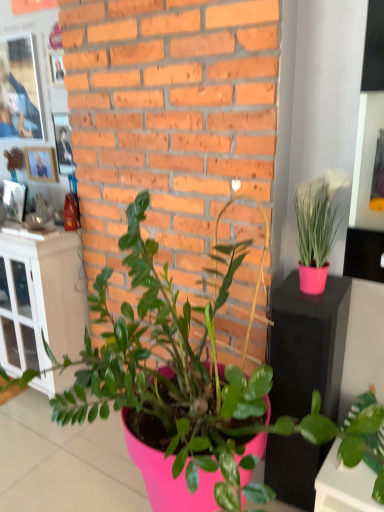
Question: From a real-world perspective, is green matte plant at lower right, positioned as the first houseplant in right-to-left order, physically located above or below wooden photo frame at upper left?

Choices:
 (A) above
 (B) below

Answer: (B)

Question: Considering the positions of green matte plant at lower right, positioned as the first houseplant in right-to-left order, and wooden photo frame at upper left in the image, is green matte plant at lower right, positioned as the first houseplant in right-to-left order, bigger or smaller than wooden photo frame at upper left?

Choices:
 (A) small
 (B) big

Answer: (B)

Question: Which object is the closest to the pink matte plant at center, the 2th houseplant viewed from the right?

Choices:
 (A) white glass cabinet at left
 (B) green matte plant at lower right, positioned as the first houseplant in right-to-left order
 (C) wooden photo frame at upper left

Answer: (B)

Question: Estimate the real-world distances between objects in this image. Which object is farther from the pink matte plant at center, acting as the first houseplant starting from the left?

Choices:
 (A) green matte plant at lower right, the second houseplant when ordered from left to right
 (B) wooden photo frame at upper left
 (C) white glass cabinet at left

Answer: (B)